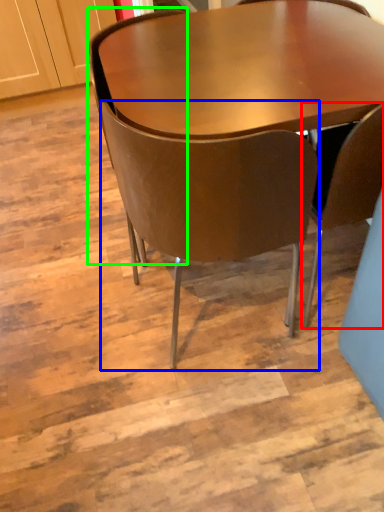
Question: Considering the real-world distances, which object is closest to chair (highlighted by a red box)? chair (highlighted by a blue box) or chair (highlighted by a green box).

Choices:
 (A) chair
 (B) chair

Answer: (A)